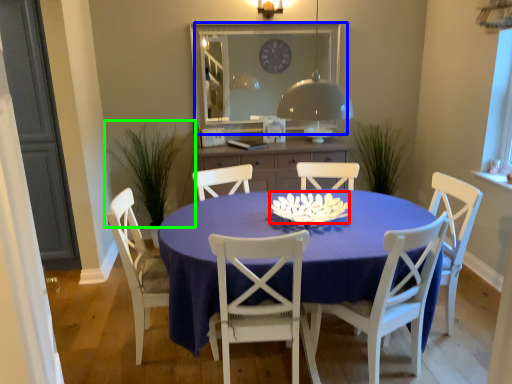
Question: Which object is the closest to the flower (highlighted by a red box)? Choose among these: window screen (highlighted by a blue box) or plant (highlighted by a green box).

Choices:
 (A) window screen
 (B) plant

Answer: (A)